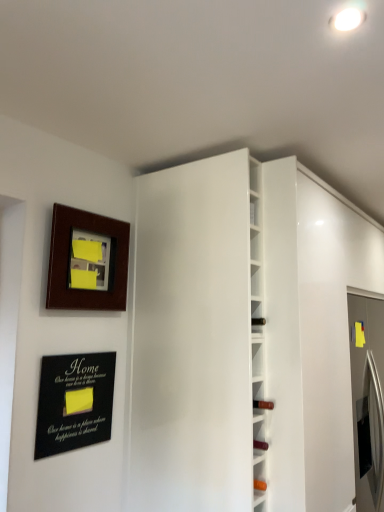
Question: Considering the positions of black matte plaque at lower left and white glossy wine rack at center in the image, is black matte plaque at lower left taller or shorter than white glossy wine rack at center?

Choices:
 (A) tall
 (B) short

Answer: (B)

Question: Looking at the image, does black matte plaque at lower left seem bigger or smaller compared to white glossy wine rack at center?

Choices:
 (A) big
 (B) small

Answer: (B)

Question: Which object is positioned closest to the black matte plaque at lower left?

Choices:
 (A) white glossy wine rack at center
 (B) white glossy door at center
 (C) wooden picture frame at upper left

Answer: (C)

Question: Estimate the real-world distances between objects in this image. Which object is farther from the black matte plaque at lower left?

Choices:
 (A) white glossy wine rack at center
 (B) wooden picture frame at upper left
 (C) white glossy door at center

Answer: (A)